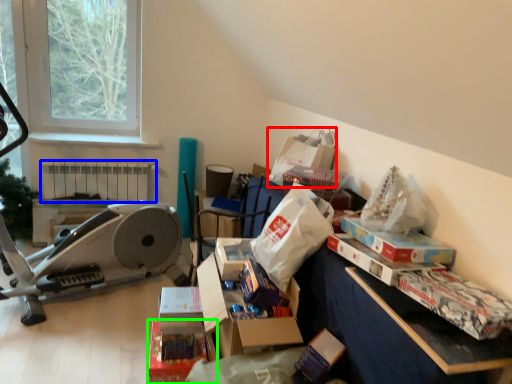
Question: Which object is the farthest from paper bag (highlighted by a red box)? Choose among these: radiator (highlighted by a blue box) or storage box (highlighted by a green box).

Choices:
 (A) radiator
 (B) storage box

Answer: (A)